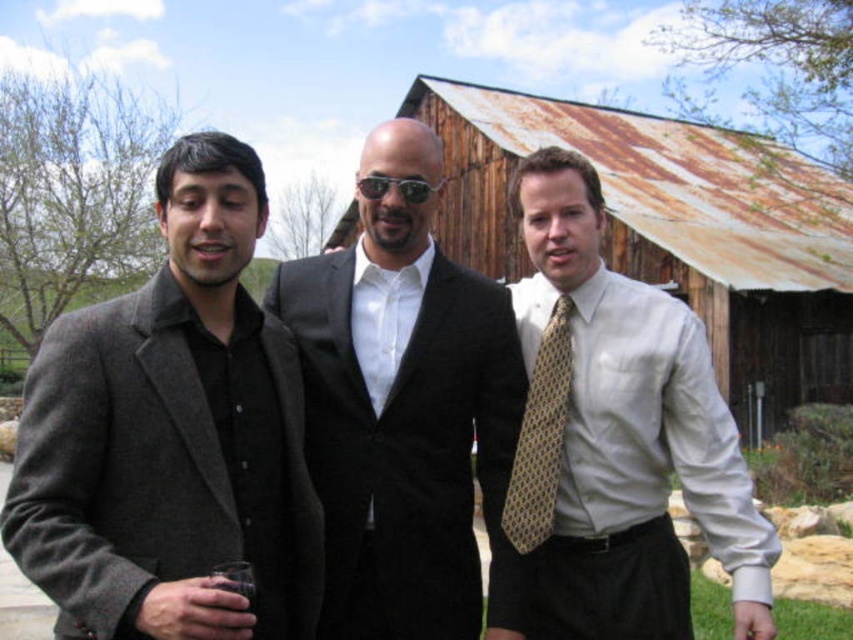
The width and height of the screenshot is (853, 640). I want to click on white silk shirt at center, so click(x=618, y=435).

Between white silk shirt at center and rusty wood hut at center, which one has more height?

Standing taller between the two is rusty wood hut at center.

Who is more distant from viewer, (585, 301) or (453, 246)?

Point (453, 246)

Locate an element on the screen. white silk shirt at center is located at coordinates (618, 435).

Can you confirm if yellow dotted tie at right is bigger than sunglasses at center?

Correct, yellow dotted tie at right is larger in size than sunglasses at center.

Consider the image. Can you confirm if yellow dotted tie at right is positioned below sunglasses at center?

Yes, yellow dotted tie at right is below sunglasses at center.

Identify the location of yellow dotted tie at right. (540, 436).

The image size is (853, 640). I want to click on yellow dotted tie at right, so click(x=540, y=436).

From the picture: Is matte gray blazer at left positioned at the back of yellow dotted tie at right?

No.

The width and height of the screenshot is (853, 640). Find the location of `matte gray blazer at left`. matte gray blazer at left is located at coordinates tap(171, 436).